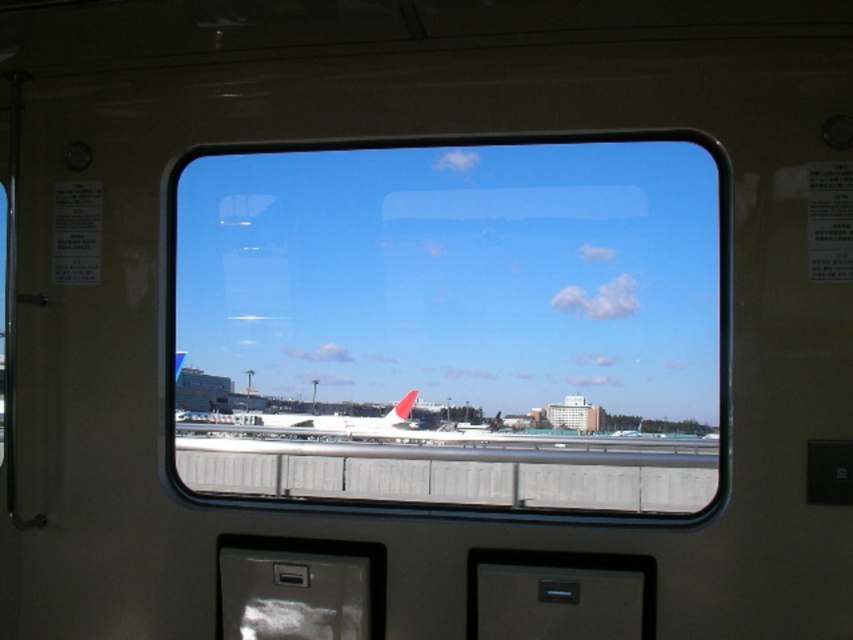
Question: Does transparent glass airplane window at center appear under white matte airplane at center?

Choices:
 (A) no
 (B) yes

Answer: (A)

Question: Does transparent glass airplane window at center appear over white matte airplane at center?

Choices:
 (A) no
 (B) yes

Answer: (B)

Question: Which point is closer to the camera?

Choices:
 (A) click(x=271, y=413)
 (B) click(x=363, y=476)

Answer: (A)

Question: Does transparent glass airplane window at center appear on the right side of white matte airplane at center?

Choices:
 (A) no
 (B) yes

Answer: (B)